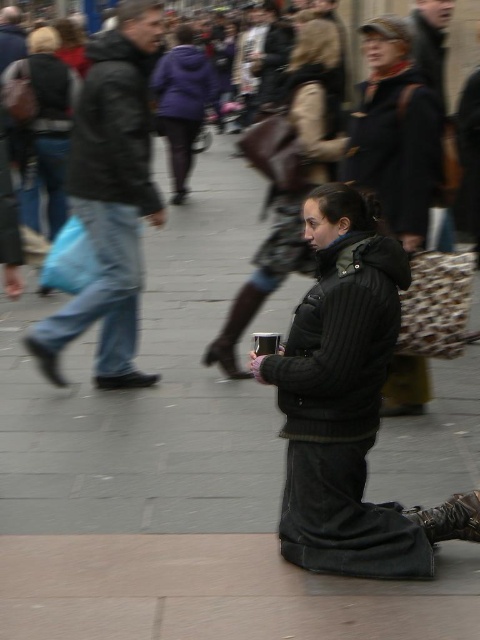
Between metallic silver cup at center and jeans at left, which one appears on the right side from the viewer's perspective?

From the viewer's perspective, metallic silver cup at center appears more on the right side.

Is metallic silver cup at center positioned in front of jeans at left?

Yes, it is in front of jeans at left.

Locate an element on the screen. metallic silver cup at center is located at coordinates (342, 396).

This screenshot has height=640, width=480. What do you see at coordinates (342, 396) in the screenshot?
I see `metallic silver cup at center` at bounding box center [342, 396].

Locate an element on the screen. The height and width of the screenshot is (640, 480). metallic silver cup at center is located at coordinates (342, 396).

Who is lower down, purple fleece jacket at center or pink fabric boot at center?

pink fabric boot at center is lower down.

Between point (179, 54) and point (217, 358), which one is positioned in front?

Point (217, 358)

I want to click on purple fleece jacket at center, so click(181, 102).

At what (x,y) coordinates should I click in order to perform the action: click on purple fleece jacket at center. Please return your answer as a coordinate pair (x, y). Image resolution: width=480 pixels, height=640 pixels. Looking at the image, I should click on (181, 102).